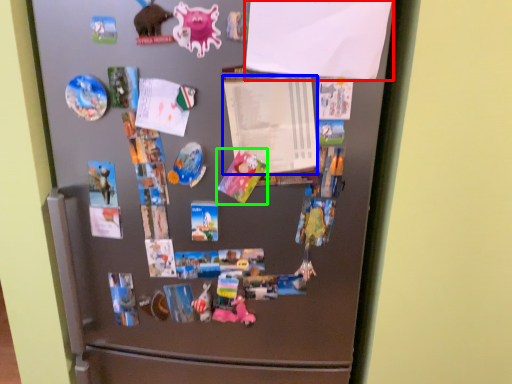
Question: Considering the real-world distances, which object is farthest from paper (highlighted by a red box)? paper (highlighted by a blue box) or art (highlighted by a green box)?

Choices:
 (A) paper
 (B) art

Answer: (B)